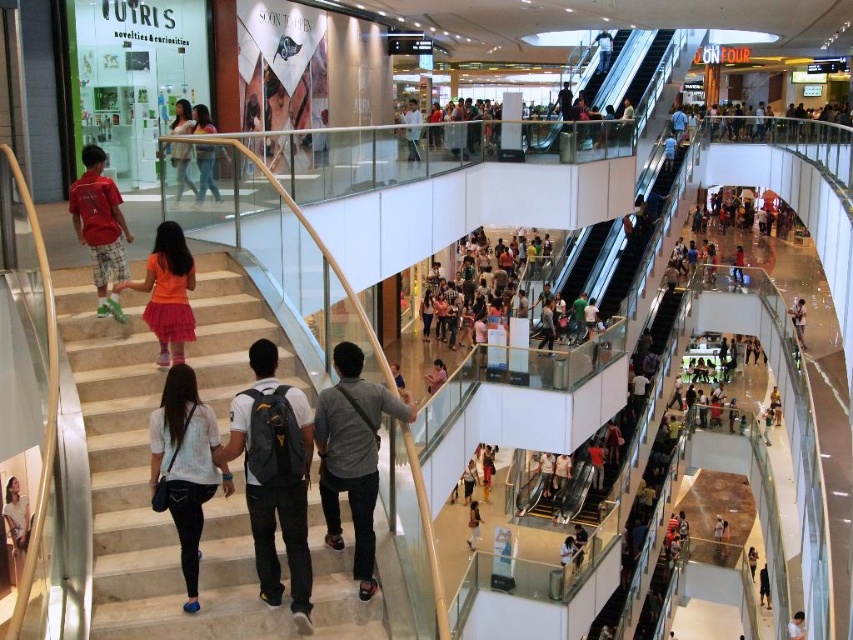
Can you confirm if red cotton shirt at left is taller than denim skirt at upper center?

No, red cotton shirt at left is not taller than denim skirt at upper center.

Between point (103, 253) and point (216, 193), which one is positioned in front?

Positioned in front is point (103, 253).

Which is behind, point (126, 236) or point (218, 192)?

The point (218, 192) is behind.

In order to click on red cotton shirt at left in this screenshot , I will do `click(100, 227)`.

Is white matte shirt at center shorter than denim skirt at upper center?

Indeed, white matte shirt at center has a lesser height compared to denim skirt at upper center.

Which is more to the left, white matte shirt at center or denim skirt at upper center?

denim skirt at upper center

Which is in front, point (183, 497) or point (207, 148)?

Point (183, 497) is in front.

At what (x,y) coordinates should I click in order to perform the action: click on white matte shirt at center. Please return your answer as a coordinate pair (x, y). The image size is (853, 640). Looking at the image, I should click on (184, 467).

Is point (424, 291) more distant than point (155, 323)?

Yes.

Does matte pink dress at center have a greater width compared to orange tulle skirt at lower left?

Correct, the width of matte pink dress at center exceeds that of orange tulle skirt at lower left.

This screenshot has height=640, width=853. What are the coordinates of `matte pink dress at center` in the screenshot? It's located at (488, 280).

At what (x,y) coordinates should I click in order to perform the action: click on matte pink dress at center. Please return your answer as a coordinate pair (x, y). Looking at the image, I should click on (488, 280).